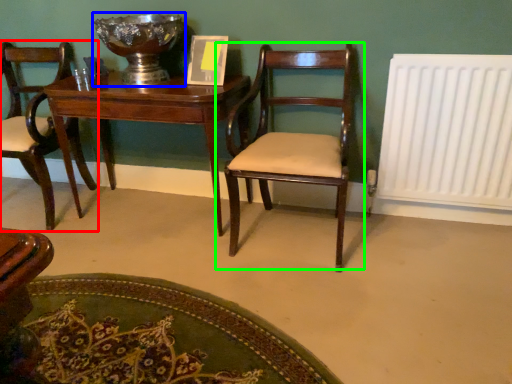
Question: Which object is positioned farthest from chair (highlighted by a red box)? Select from glass bowl (highlighted by a blue box) and chair (highlighted by a green box).

Choices:
 (A) glass bowl
 (B) chair

Answer: (B)